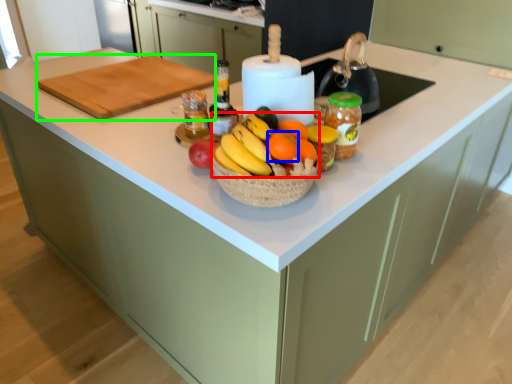
Question: Based on their relative distances, which object is farther from grapefruit (highlighted by a red box)? Choose from orange (highlighted by a blue box) and cutting board (highlighted by a green box).

Choices:
 (A) orange
 (B) cutting board

Answer: (B)